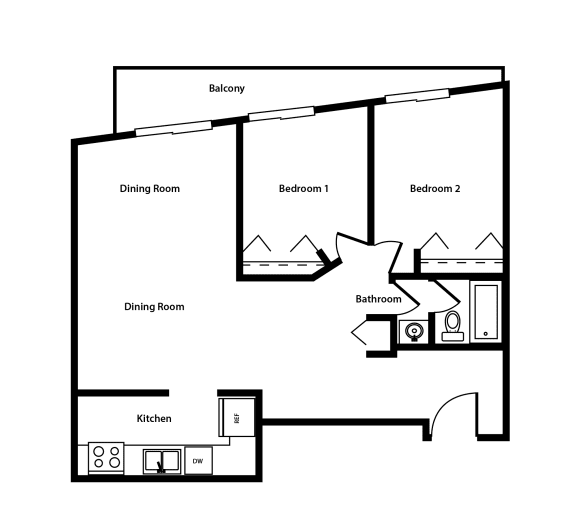
At what (x,y) coordinates should I click in order to perform the action: click on bedroom. Please return your answer as a coordinate pair (x, y). Image resolution: width=576 pixels, height=518 pixels. Looking at the image, I should click on (465, 199).